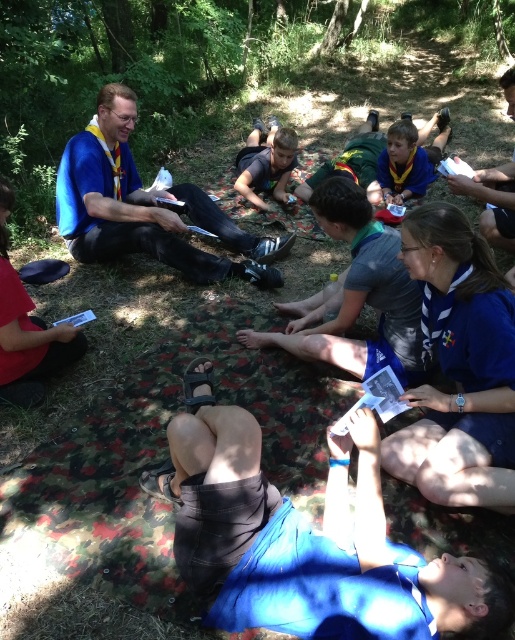
From the picture: Is blue fabric at lower center shorter than matte black phone at center?

Indeed, blue fabric at lower center has a lesser height compared to matte black phone at center.

What do you see at coordinates (305, 540) in the screenshot?
I see `blue fabric at lower center` at bounding box center [305, 540].

Locate an element on the screen. blue fabric at lower center is located at coordinates (305, 540).